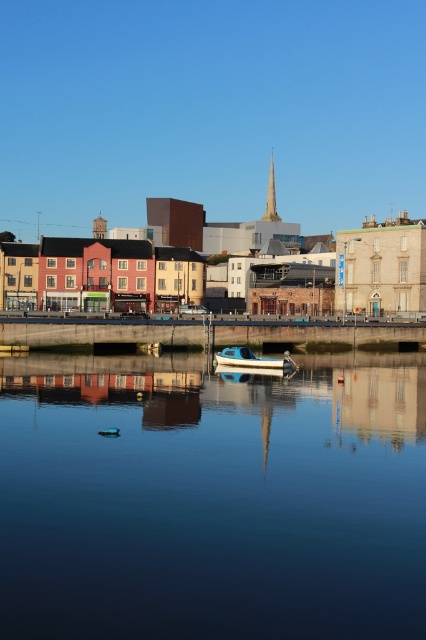
Where is `white plastic boat at center`? This screenshot has height=640, width=426. white plastic boat at center is located at coordinates (253, 358).

Where is `white plastic boat at center`? This screenshot has width=426, height=640. white plastic boat at center is located at coordinates (253, 358).

Does concrete dock at center lie behind golden stone spire at center?

No.

Is concrete dock at center closer to the viewer compared to golden stone spire at center?

Yes, it is.

Locate an element on the screen. This screenshot has height=640, width=426. concrete dock at center is located at coordinates (204, 332).

Is point (204, 400) in front of point (241, 337)?

Yes, point (204, 400) is closer to viewer.

Which is above, smooth glass water at center or concrete dock at center?

concrete dock at center is above.

This screenshot has width=426, height=640. I want to click on smooth glass water at center, so click(x=212, y=499).

Where is `smooth glass water at center`? The width and height of the screenshot is (426, 640). smooth glass water at center is located at coordinates (212, 499).